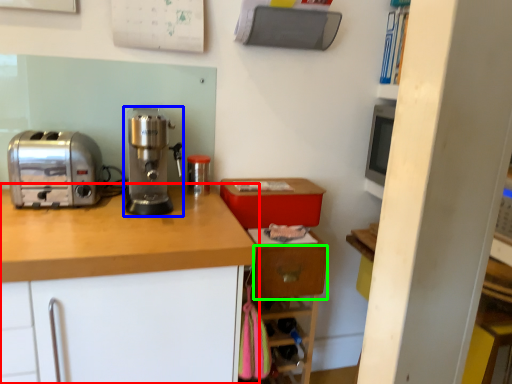
Question: Based on their relative distances, which object is nearer to cabinetry (highlighted by a red box)? Choose from home appliance (highlighted by a blue box) and drawer (highlighted by a green box).

Choices:
 (A) home appliance
 (B) drawer

Answer: (A)